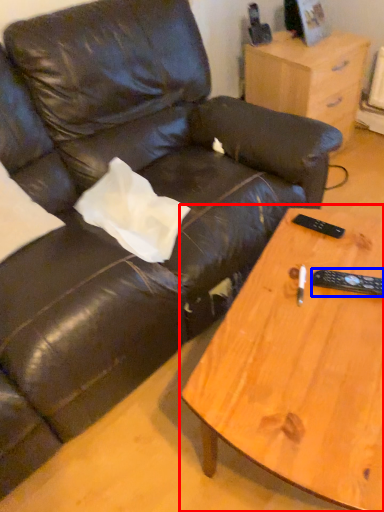
Question: Which point is further to the camera, coffee table (highlighted by a red box) or remote (highlighted by a blue box)?

Choices:
 (A) coffee table
 (B) remote

Answer: (B)